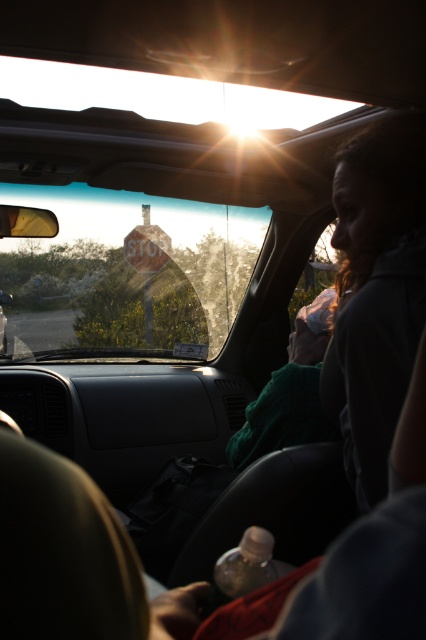
Based on the photo, you are a passenger in the car and notice the transparent glass stop sign at center. Based on its position relative to the dashboard and steering wheel, can you estimate whether it is closer to the windshield or the dashboard?

The transparent glass stop sign at center is located at point coordinates that are closer to the windshield than the dashboard, so it is closer to the windshield.

You are a passenger in the car and notice two stop signs outside the windshield. The transparent glass stop sign at center and the rusty metal stop sign at center. Which one is shorter?

The transparent glass stop sign at center is shorter than the rusty metal stop sign at center.